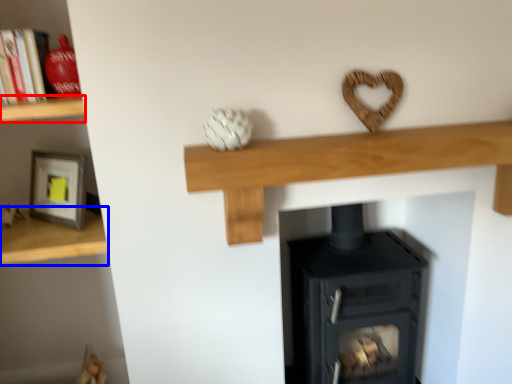
Question: Among these objects, which one is farthest to the camera, shelf (highlighted by a red box) or shelf (highlighted by a blue box)?

Choices:
 (A) shelf
 (B) shelf

Answer: (B)